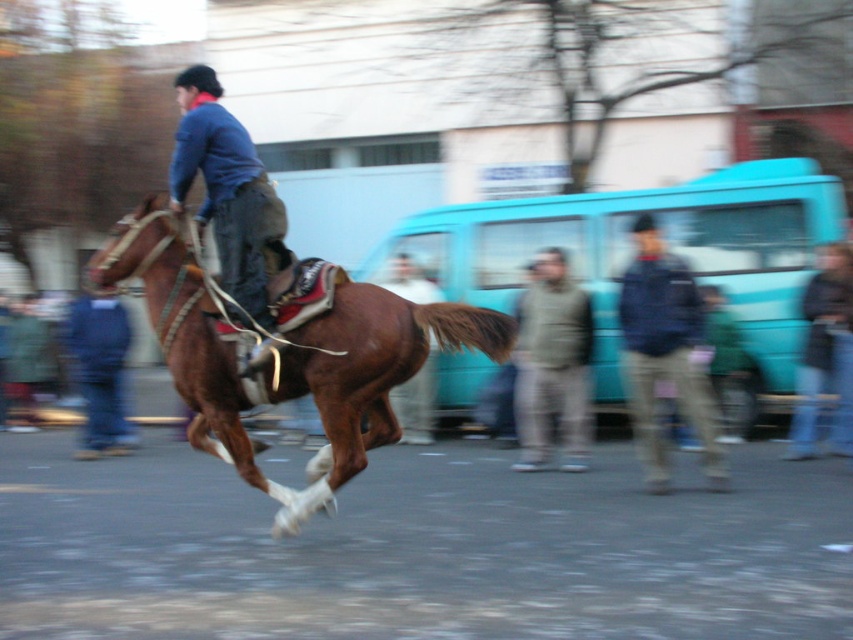
Is brown glossy horse at center smaller than gray woolen jacket at center?

No.

Does point (123, 243) lie in front of point (554, 352)?

That is True.

The height and width of the screenshot is (640, 853). In order to click on brown glossy horse at center in this screenshot , I will do `click(287, 356)`.

Does blue denim jacket at upper left have a greater height compared to dark blue jacket at center?

Incorrect, blue denim jacket at upper left's height is not larger of dark blue jacket at center's.

Does blue denim jacket at upper left appear on the left side of dark blue jacket at center?

Correct, you'll find blue denim jacket at upper left to the left of dark blue jacket at center.

The width and height of the screenshot is (853, 640). What do you see at coordinates (228, 193) in the screenshot? I see `blue denim jacket at upper left` at bounding box center [228, 193].

Find the location of a particular element. This screenshot has height=640, width=853. blue denim jacket at upper left is located at coordinates (228, 193).

Is brown glossy horse at center wider than blue denim jacket at upper left?

Yes.

Does point (233, 401) come behind point (202, 129)?

That is True.

The image size is (853, 640). Find the location of `brown glossy horse at center`. brown glossy horse at center is located at coordinates (287, 356).